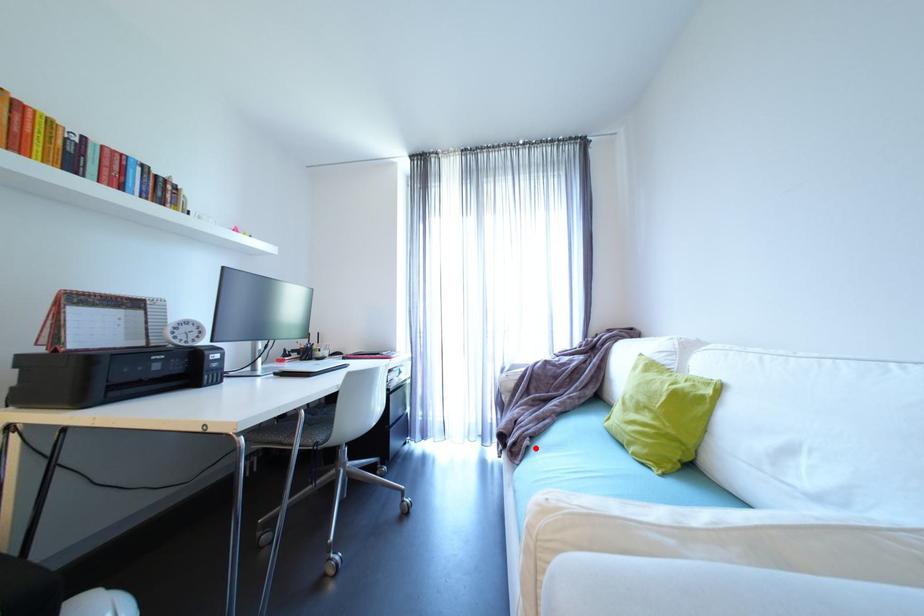
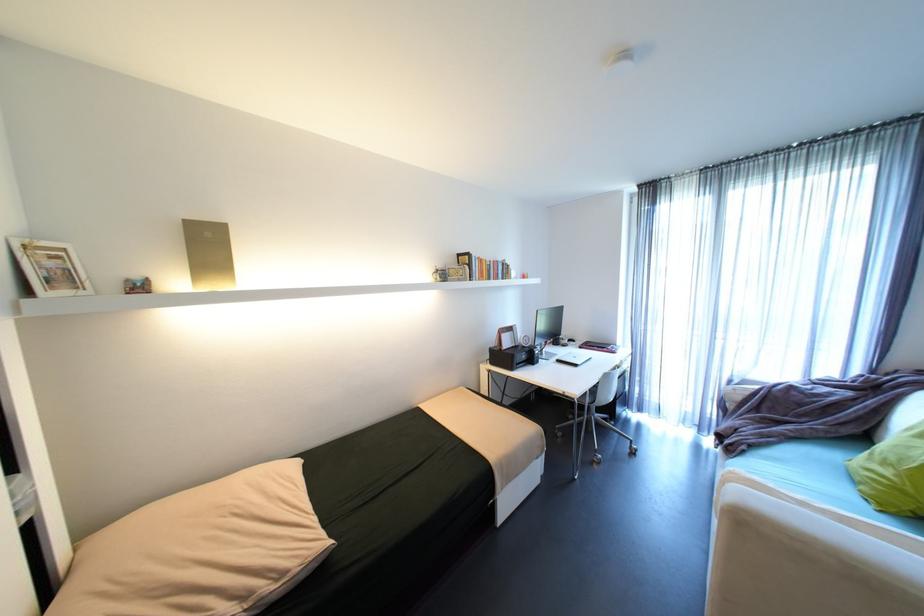
In the second image, find the point that corresponds to the highlighted location in the first image.

(751, 451)